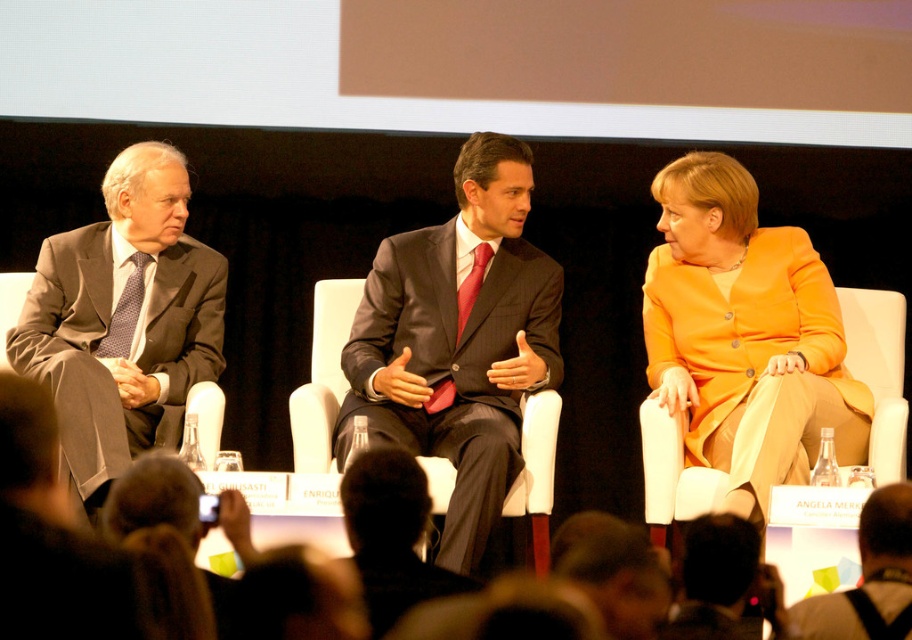
Question: Observing the image, what is the correct spatial positioning of orange fabric dress at upper right in reference to red silk tie at center?

Choices:
 (A) left
 (B) right

Answer: (B)

Question: Which of the following is the farthest from the observer?

Choices:
 (A) matte gray suit at left
 (B) dark hair at lower center

Answer: (A)

Question: Among these objects, which one is nearest to the camera?

Choices:
 (A) orange fabric dress at upper right
 (B) red silk tie at center
 (C) dark hair at lower center
 (D) brushed metal water at bottle left

Answer: (D)

Question: Which of the following is the farthest from the observer?

Choices:
 (A) red silk tie at center
 (B) matte black suit at center

Answer: (A)

Question: Can you confirm if matte black suit at center is positioned below matte gray suit at left?

Choices:
 (A) yes
 (B) no

Answer: (A)

Question: Does blue dotted tie at left have a larger size compared to red silk tie at center?

Choices:
 (A) yes
 (B) no

Answer: (A)